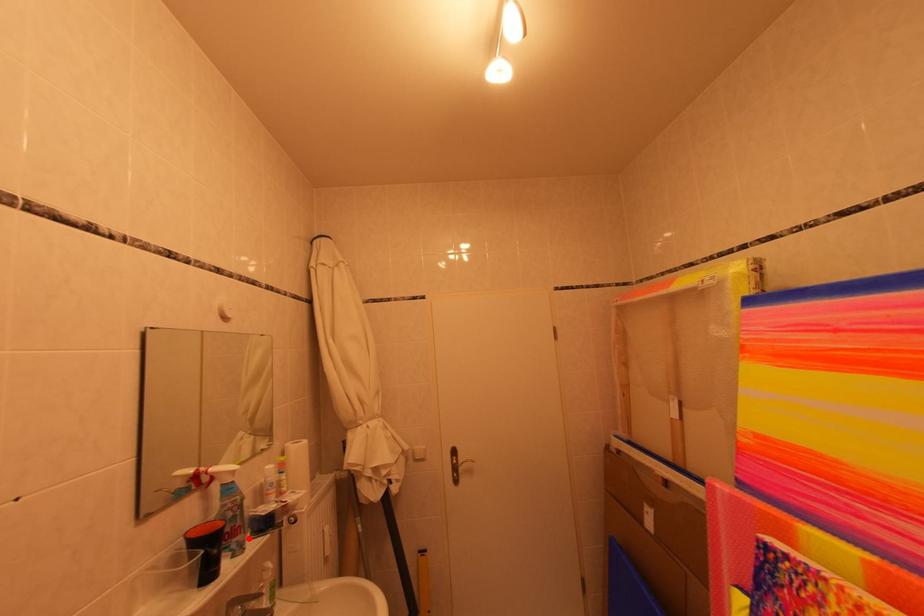
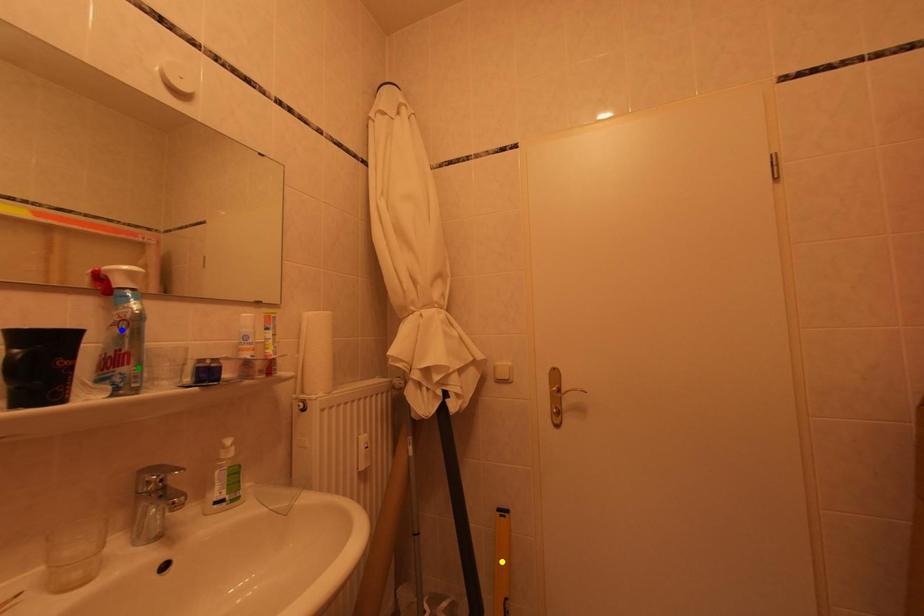
Question: I am providing you with two images of the same scene from different viewpoints. A red point is marked on the first image. You are given multiple points on the second image. Which point in image 2 represents the same 3d spot as the red point in image 1?

Choices:
 (A) blue point
 (B) green point
 (C) yellow point

Answer: (B)